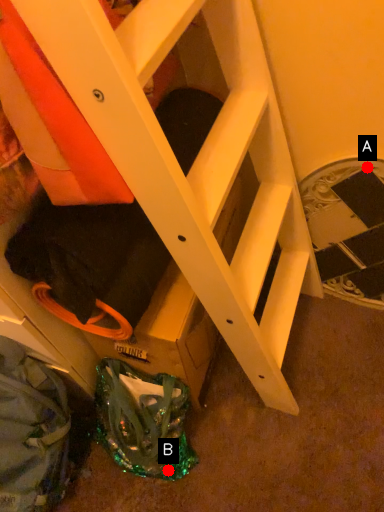
Question: Two points are circled on the image, labeled by A and B beside each circle. Which point appears farthest from the camera in this image?

Choices:
 (A) A is further
 (B) B is further

Answer: (B)